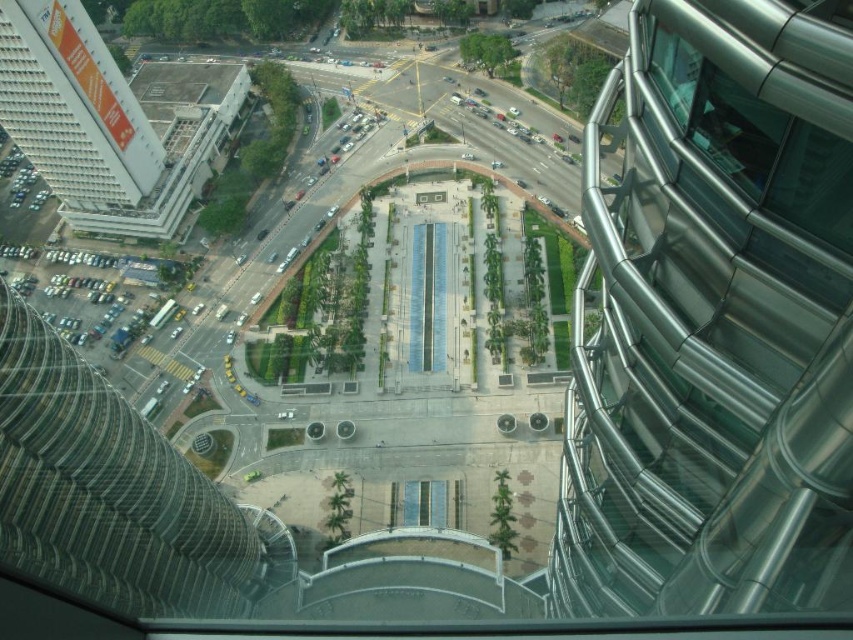
Which is in front, point (670, 525) or point (175, 97)?

Point (670, 525) is more forward.

Is metallic silver tower at right wider than white textured building at upper left?

No.

Does point (828, 49) lie behind point (194, 100)?

No, (828, 49) is closer to viewer.

Where is `metallic silver tower at right`? This screenshot has height=640, width=853. metallic silver tower at right is located at coordinates (714, 321).